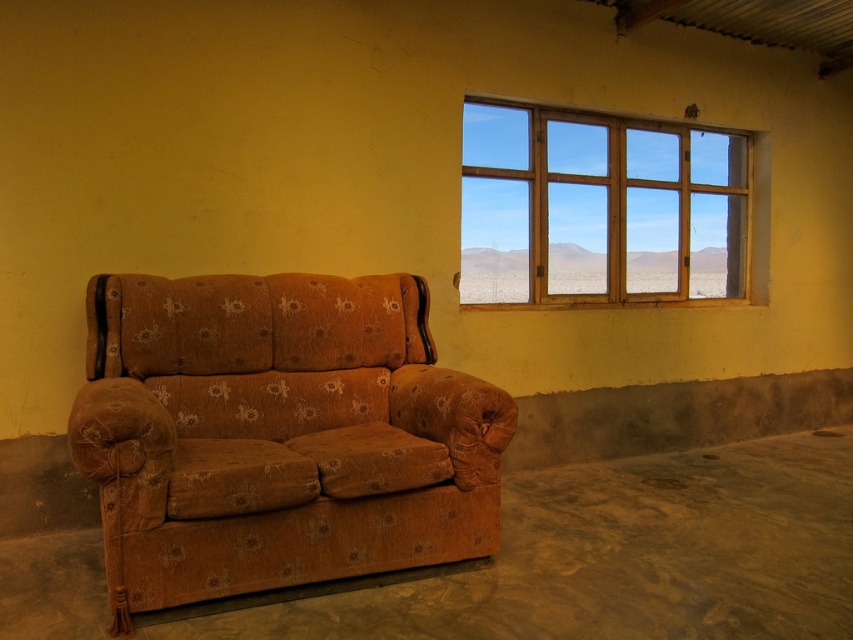
Question: Can you confirm if brown floral fabric couch at lower left is positioned to the left of wooden window at upper right?

Choices:
 (A) yes
 (B) no

Answer: (A)

Question: Which of the following is the farthest from the observer?

Choices:
 (A) (444, 376)
 (B) (747, 170)

Answer: (B)

Question: Which point is farther to the camera?

Choices:
 (A) brown floral fabric couch at lower left
 (B) wooden window at upper right

Answer: (B)

Question: Considering the relative positions of brown floral fabric couch at lower left and wooden window at upper right in the image provided, where is brown floral fabric couch at lower left located with respect to wooden window at upper right?

Choices:
 (A) below
 (B) above

Answer: (A)

Question: Which object is closer to the camera taking this photo?

Choices:
 (A) wooden window at upper right
 (B) brown floral fabric couch at lower left

Answer: (B)

Question: Is brown floral fabric couch at lower left thinner than wooden window at upper right?

Choices:
 (A) yes
 (B) no

Answer: (A)